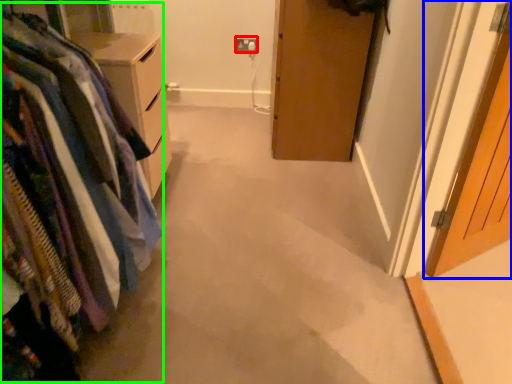
Question: Which is farther away from electric outlet (highlighted by a red box)? door (highlighted by a blue box) or closet (highlighted by a green box)?

Choices:
 (A) door
 (B) closet

Answer: (B)